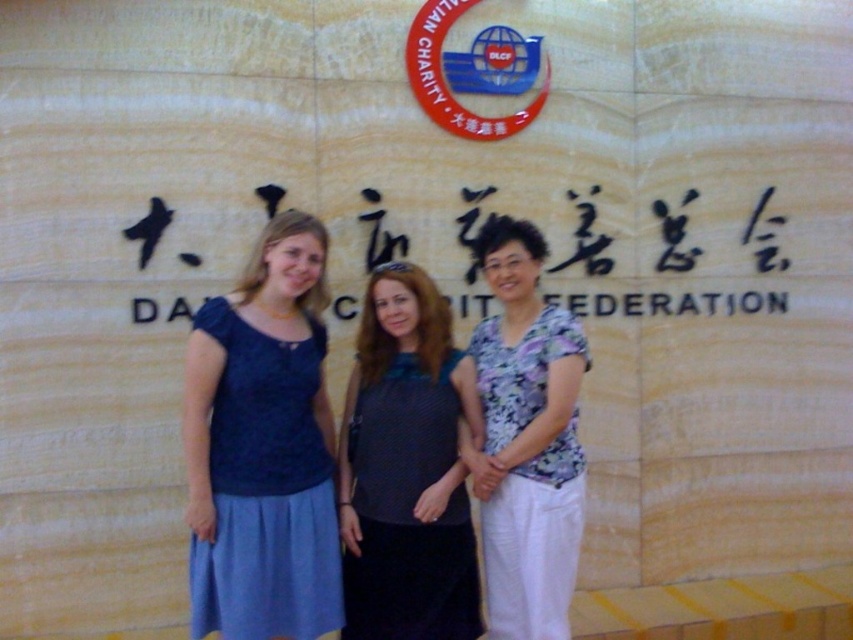
You are standing in front of the Dalian Charity Federation wall and want to take a photo of the person wearing the matte gray top at center. Where should you position yourself to ensure the person is centered in your camera viewfinder?

To center the matte gray top at center in your camera viewfinder, position yourself directly in front of the location at point coordinates 0.734 on the x axis and 0.477 on the y axis relative to the image frame.